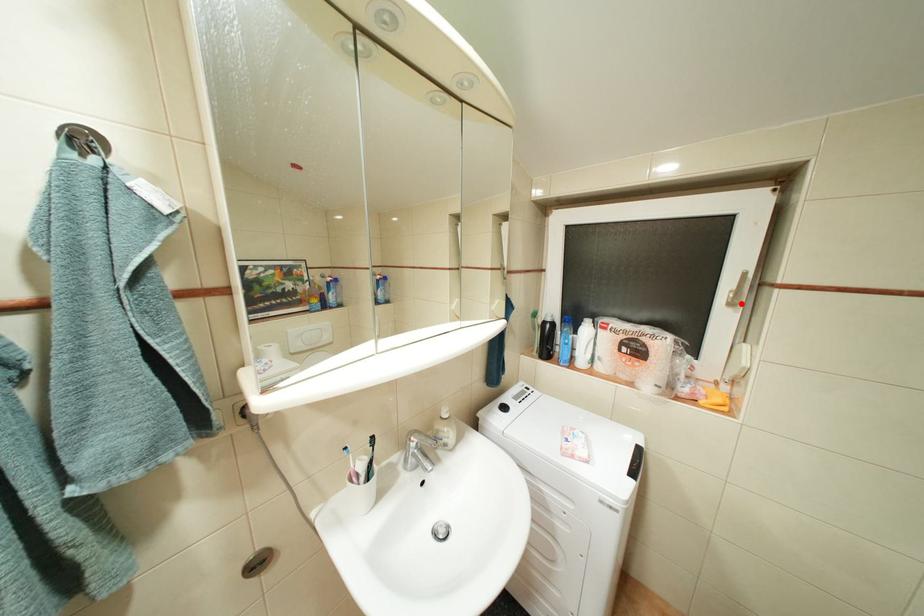
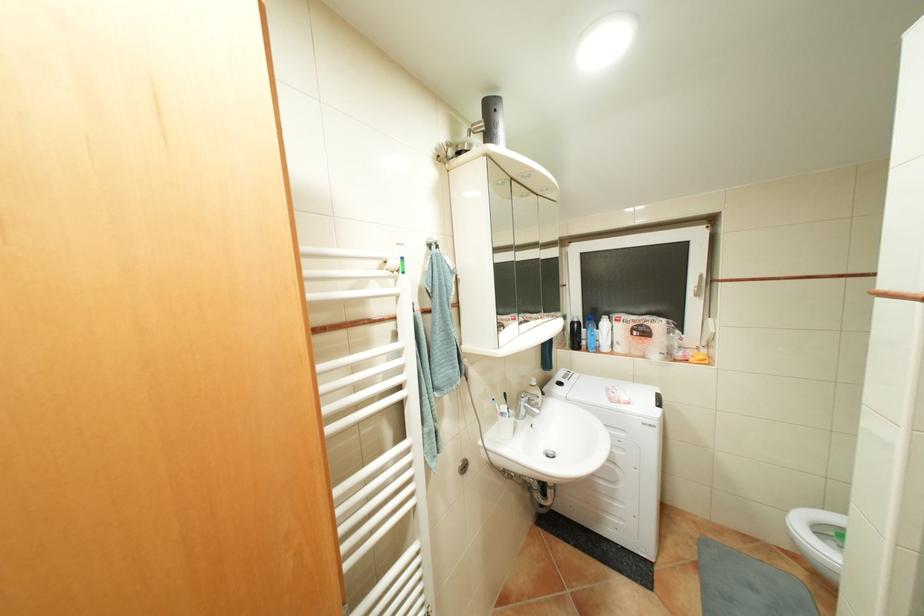
Locate, in the second image, the point that corresponds to the highlighted location in the first image.

(707, 294)